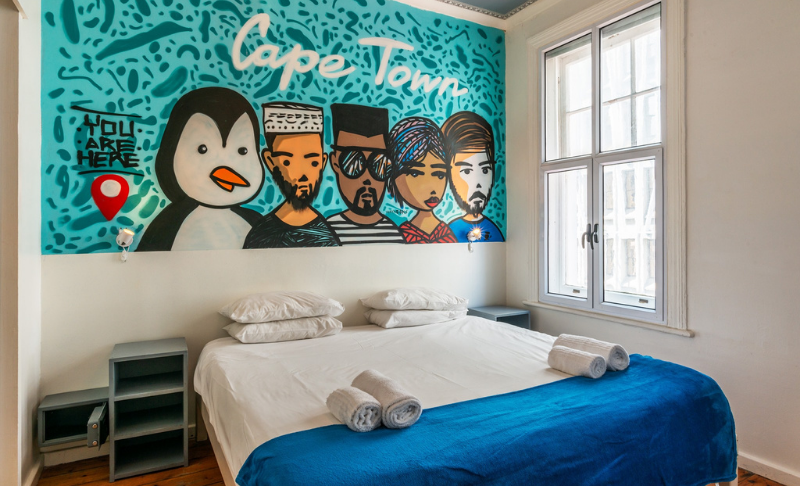
Where is `pillow`? This screenshot has width=800, height=486. pillow is located at coordinates (270, 299).